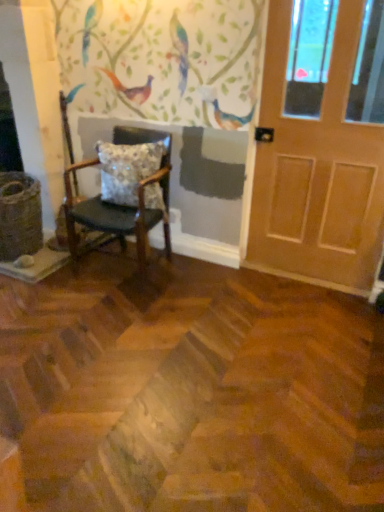
Question: Which is correct: light brown wooden door at right is inside wooden chair with cushion at left, or outside of it?

Choices:
 (A) inside
 (B) outside

Answer: (B)

Question: From a real-world perspective, is light brown wooden door at right physically located above or below wooden chair with cushion at left?

Choices:
 (A) below
 (B) above

Answer: (B)

Question: Which is nearer to the light brown wooden door at right?

Choices:
 (A) floral-patterned fabric pillow at center
 (B) wooden chair with cushion at left

Answer: (A)

Question: Based on their relative distances, which object is nearer to the floral-patterned fabric pillow at center?

Choices:
 (A) wooden chair with cushion at left
 (B) light brown wooden door at right

Answer: (A)